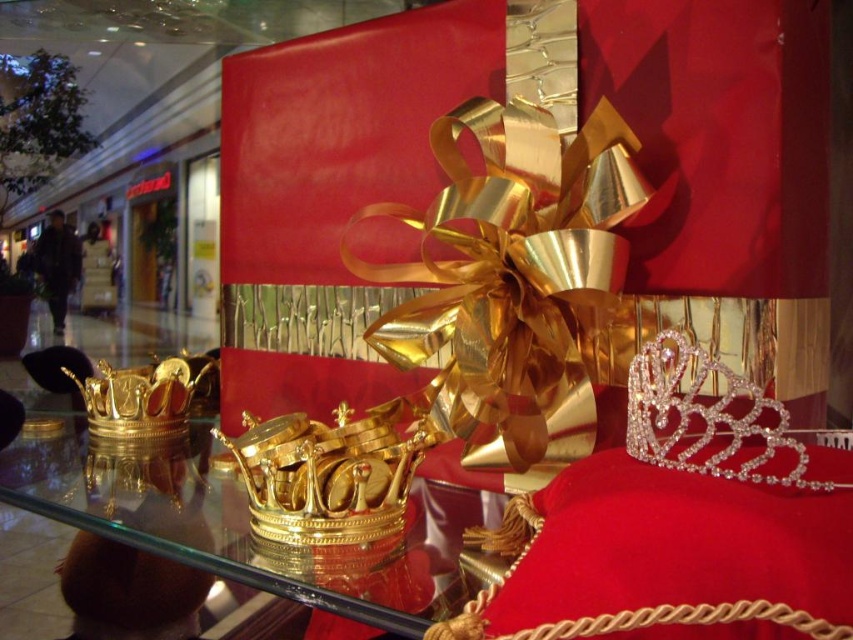
Question: Is transparent glass crown at center above gold shiny crown at center?

Choices:
 (A) yes
 (B) no

Answer: (B)

Question: Does transparent glass crown at center appear over clear crystal tiara at upper right?

Choices:
 (A) yes
 (B) no

Answer: (B)

Question: Which point is closer to the camera?

Choices:
 (A) transparent glass crown at center
 (B) gold shiny crown at left
 (C) clear crystal tiara at upper right

Answer: (C)

Question: Is transparent glass crown at center positioned in front of gold shiny crown at center?

Choices:
 (A) yes
 (B) no

Answer: (A)

Question: Which point is closer to the camera?

Choices:
 (A) clear crystal tiara at upper right
 (B) gold shiny crown at center
 (C) transparent glass crown at center

Answer: (A)

Question: Which point appears closest to the camera in this image?

Choices:
 (A) click(x=273, y=582)
 (B) click(x=109, y=436)
 (C) click(x=387, y=403)
 (D) click(x=695, y=419)

Answer: (A)